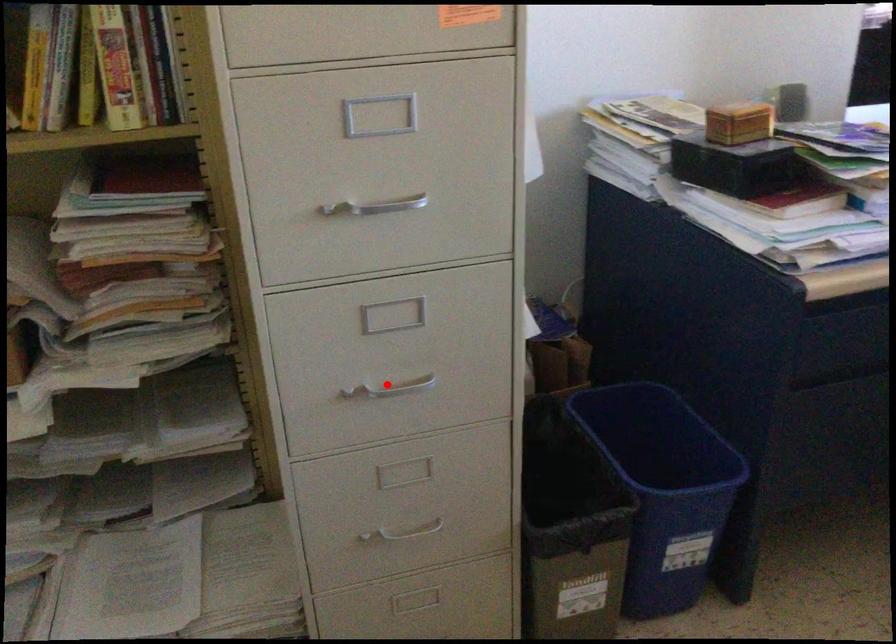
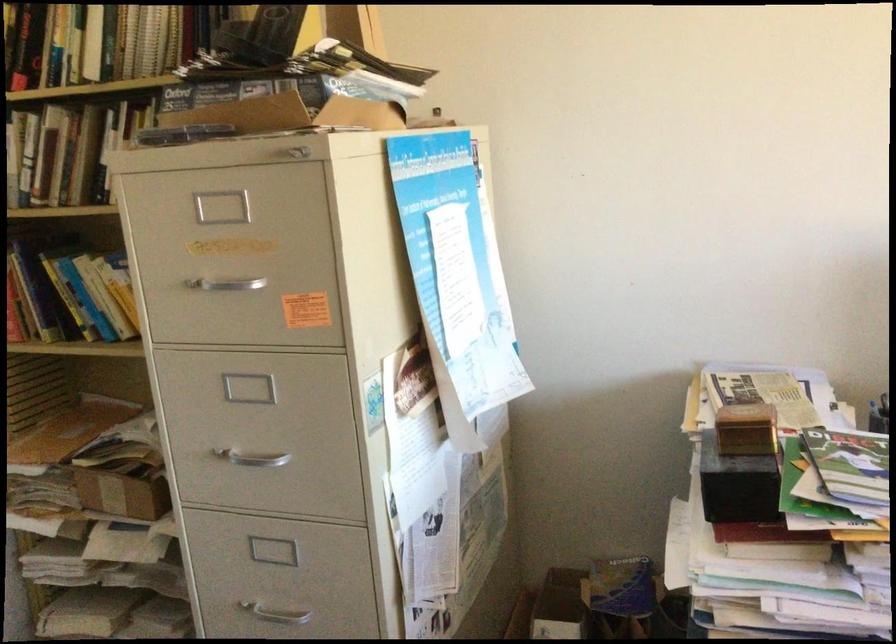
The point at the highlighted location is marked in the first image. Where is the corresponding point in the second image?

(273, 608)